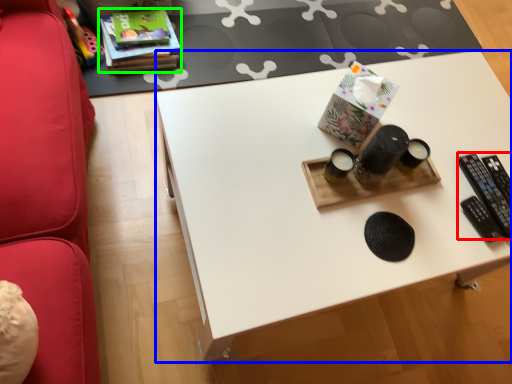
Question: Which object is positioned farthest from control (highlighted by a red box)? Select from desk (highlighted by a blue box) and book (highlighted by a green box).

Choices:
 (A) desk
 (B) book

Answer: (B)